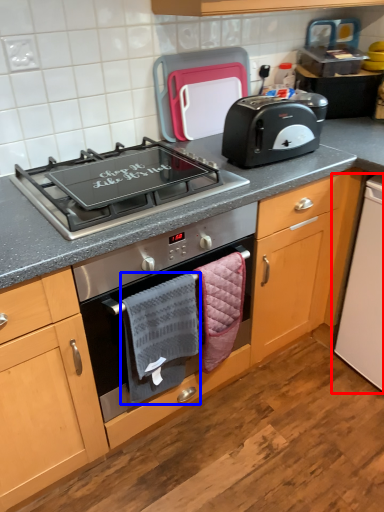
Question: Which object appears closest to the camera in this image, appliance (highlighted by a red box) or hand towel (highlighted by a blue box)?

Choices:
 (A) appliance
 (B) hand towel

Answer: (B)